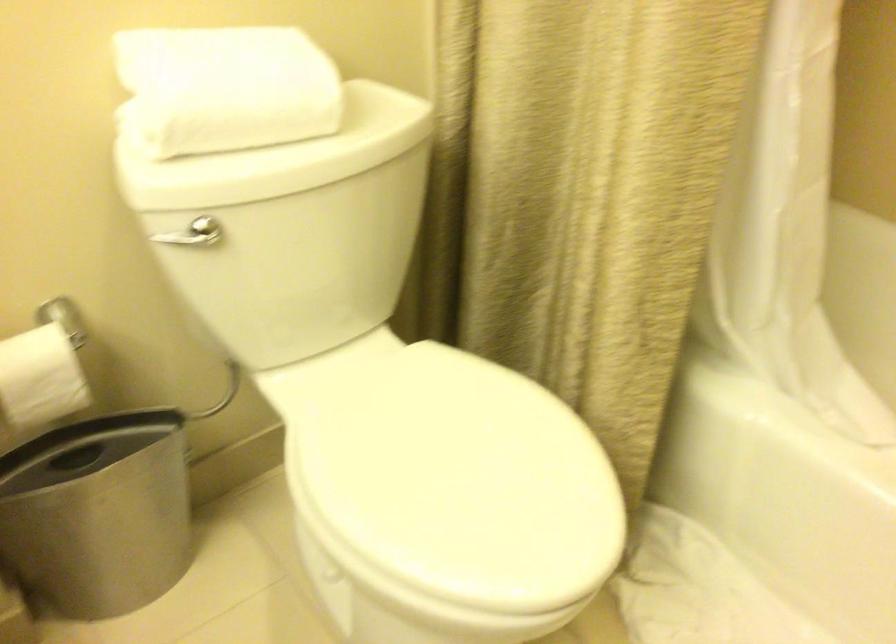
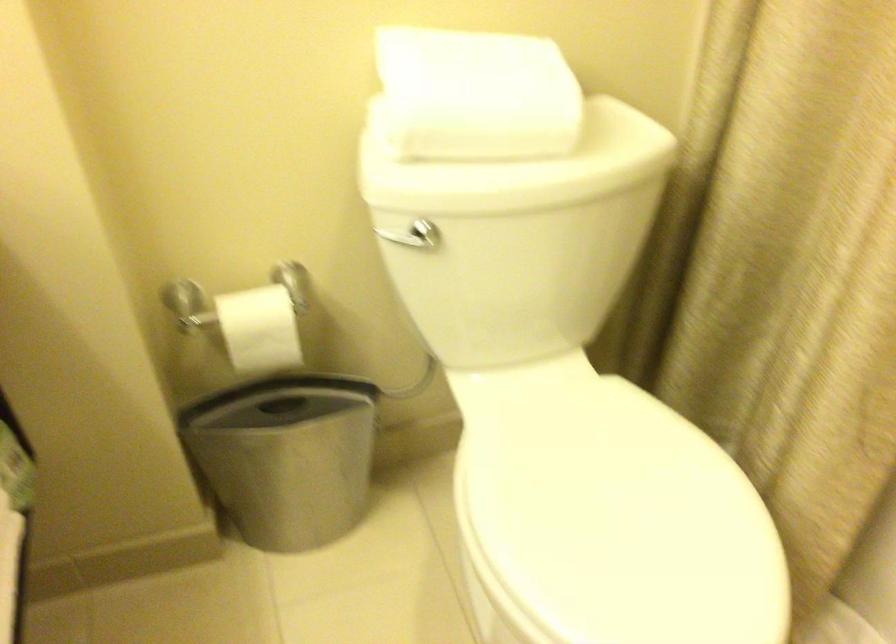
Find the pixel in the second image that matches point (289, 151) in the first image.

(519, 167)